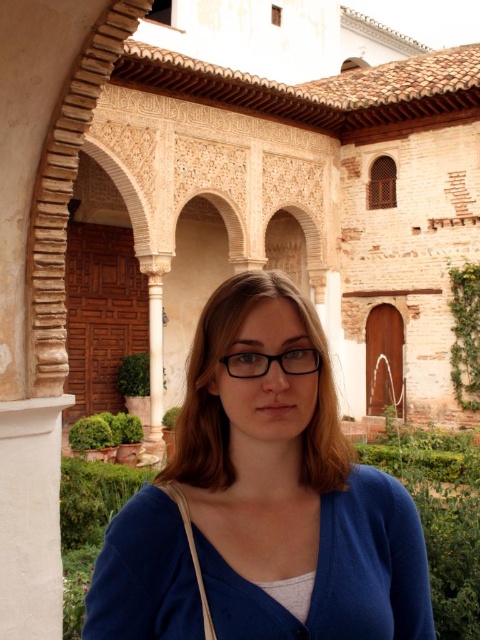
In the scene shown: You are a tourist standing in front of the historical structure. You notice the blue fabric at center. Based on its position, can you determine if it is closer to the left or right side of the walkway?

The blue fabric at center is located at point coordinates suggesting it is closer to the right side of the walkway since its x coordinate is 0.787, which is closer to the right edge of the frame.

You are a fashion designer analyzing clothing items in an image. You see a blue knitted sweater at center and transparent plastic glasses at center. Which clothing item is wider?

The blue knitted sweater at center is wider than the transparent plastic glasses at center, as its width surpasses that of the glasses.

You are a photographer trying to capture the person in the scene. Since the blue fabric at center and transparent plastic glasses at center are both in the frame, which one should you focus on to ensure the person is in sharp focus?

The blue fabric at center is in front of transparent plastic glasses at center, so focusing on the blue fabric at center will ensure the person is in sharp focus.